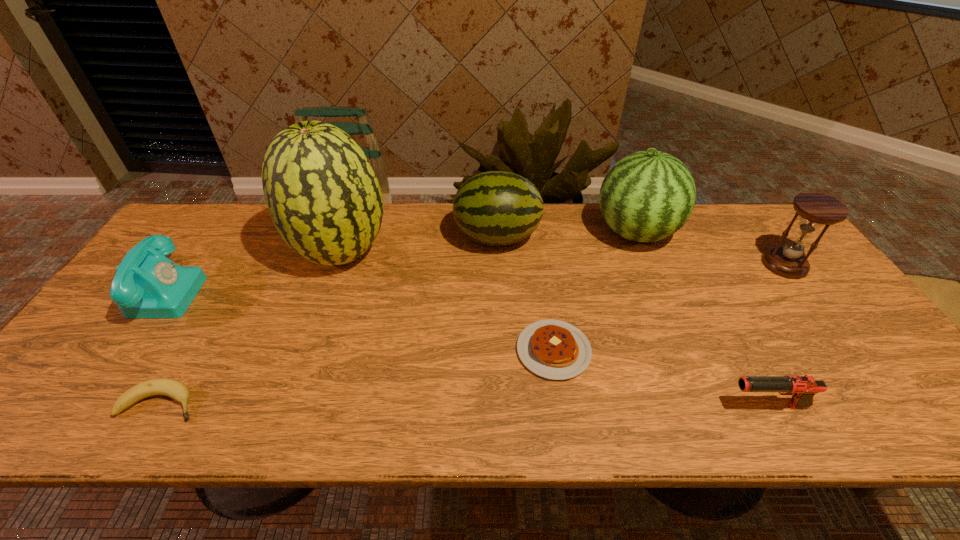
I want to click on free point located on the front of the tallest watermelon, so click(316, 327).

Where is `vacant space located 0.220m on the left of the rightmost watermelon`? The height and width of the screenshot is (540, 960). vacant space located 0.220m on the left of the rightmost watermelon is located at coordinates (523, 233).

Where is `free spot located 0.070m at the stem end of the shortest watermelon`? The image size is (960, 540). free spot located 0.070m at the stem end of the shortest watermelon is located at coordinates (432, 237).

Identify the location of free space located at the stem end of the shortest watermelon. (331, 237).

Identify the location of vacant space located 0.080m at the stem end of the shortest watermelon. (428, 237).

Find the location of a particular element. This screenshot has width=960, height=540. free spot located 0.260m on the front of the hourglass is located at coordinates (852, 356).

At what (x,y) coordinates should I click in order to perform the action: click on vacant region located 0.230m on the dial of the fifth tallest object. Please return your answer as a coordinate pair (x, y). The image size is (960, 540). Looking at the image, I should click on (284, 290).

At what (x,y) coordinates should I click in order to perform the action: click on vacant space located 0.130m at the aiming end of the sixth tallest object. Please return your answer as a coordinate pair (x, y). This screenshot has width=960, height=540. Looking at the image, I should click on (665, 407).

Locate an element on the screen. The height and width of the screenshot is (540, 960). free space located at the aiming end of the sixth tallest object is located at coordinates (564, 407).

This screenshot has width=960, height=540. In order to click on free space located 0.090m at the aiming end of the sixth tallest object in this screenshot , I will do `click(684, 407)`.